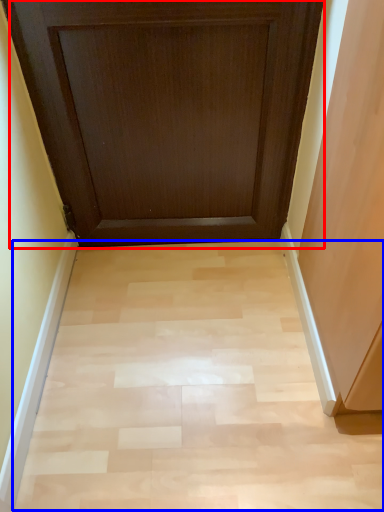
Question: Among these objects, which one is nearest to the camera, door (highlighted by a red box) or plain (highlighted by a blue box)?

Choices:
 (A) door
 (B) plain

Answer: (A)